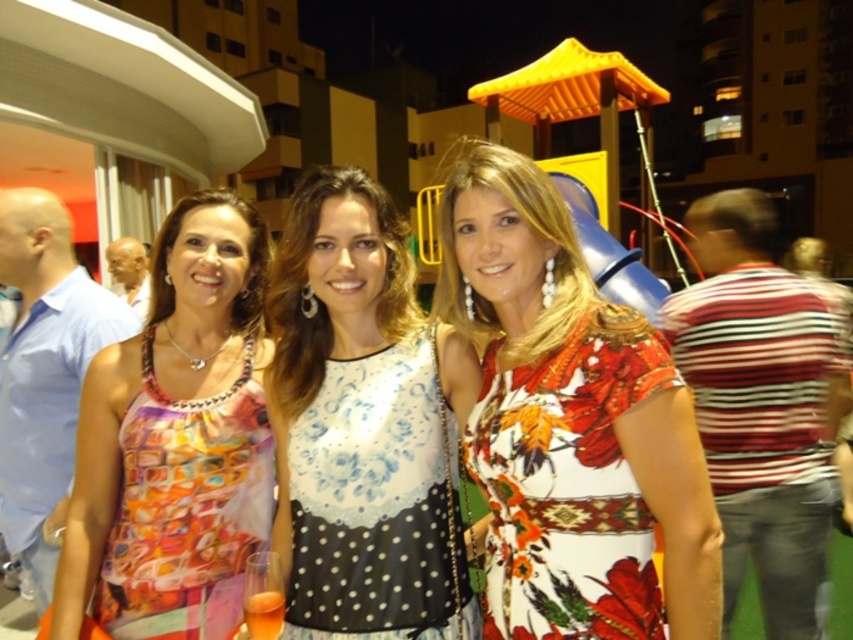
Question: Can you confirm if floral print dress at center is positioned below white lace tank top at center?

Choices:
 (A) yes
 (B) no

Answer: (B)

Question: Does floral print dress at center have a smaller size compared to multicolored printed dress at center?

Choices:
 (A) no
 (B) yes

Answer: (A)

Question: Which of these objects is positioned closest to the floral print dress at center?

Choices:
 (A) multicolored printed dress at center
 (B) white lace tank top at center

Answer: (B)

Question: Which of these objects is positioned farthest from the floral print dress at center?

Choices:
 (A) multicolored printed dress at center
 (B) white lace tank top at center

Answer: (A)

Question: Which object is farther from the camera taking this photo?

Choices:
 (A) floral print dress at center
 (B) multicolored printed dress at center

Answer: (B)

Question: Does floral print dress at center appear on the left side of multicolored printed dress at center?

Choices:
 (A) yes
 (B) no

Answer: (B)